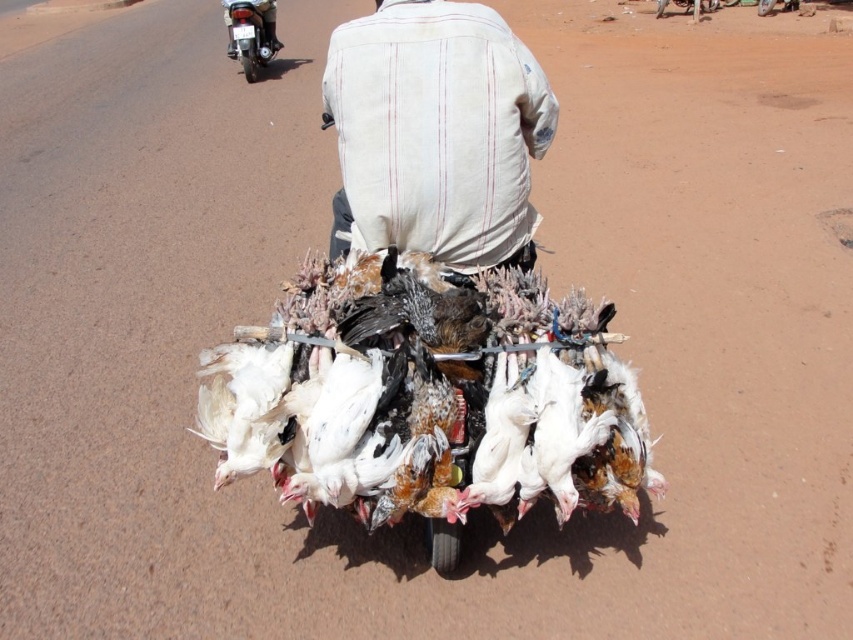
Question: Which point is farther from the camera taking this photo?

Choices:
 (A) (252, 1)
 (B) (267, 332)

Answer: (A)

Question: Can you confirm if white feathered chicken at center is bigger than white striped shirt at center?

Choices:
 (A) no
 (B) yes

Answer: (A)

Question: Is white striped shirt at center closer to the viewer compared to brushed metal motorcycle at upper left?

Choices:
 (A) no
 (B) yes

Answer: (B)

Question: Which point appears farthest from the camera in this image?

Choices:
 (A) (463, 112)
 (B) (363, 467)

Answer: (A)

Question: Does white feathered chicken at center appear on the left side of brushed metal motorcycle at upper left?

Choices:
 (A) no
 (B) yes

Answer: (A)

Question: Which point is farther to the camera?

Choices:
 (A) white striped shirt at center
 (B) brushed metal motorcycle at upper left
 (C) white feathered chicken at center

Answer: (B)